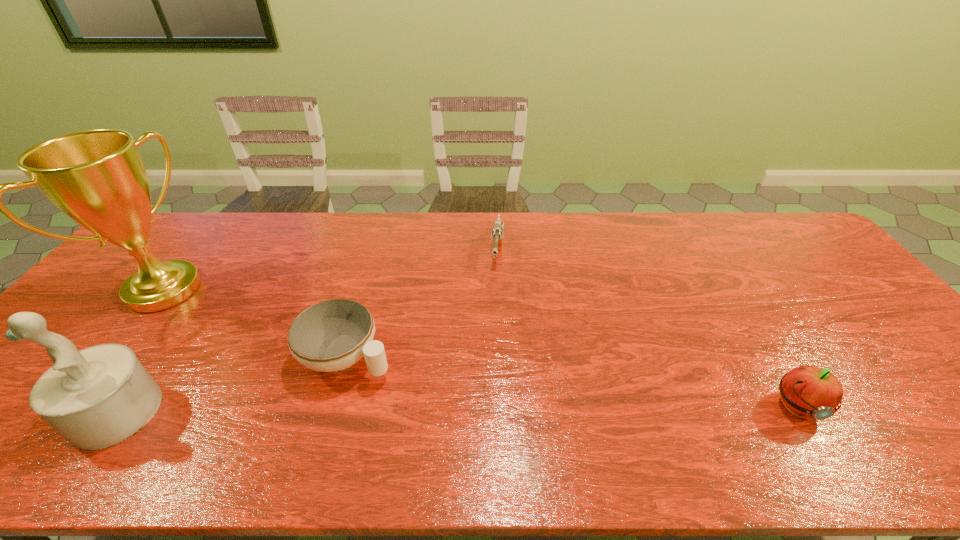
This screenshot has width=960, height=540. What are the coordinates of `figurine` in the screenshot? It's located at (99, 396).

Where is `the rightmost object`? the rightmost object is located at coordinates (x=810, y=392).

Image resolution: width=960 pixels, height=540 pixels. What are the coordinates of `the fourth object from left to right` in the screenshot? It's located at (497, 232).

Where is `chinaware`? chinaware is located at coordinates (332, 335).

Where is `award`? award is located at coordinates (96, 177).

The width and height of the screenshot is (960, 540). Find the location of `vacant space located at the beak of the figurine`. vacant space located at the beak of the figurine is located at coordinates (50, 412).

You are a GUI agent. You are given a task and a screenshot of the screen. Output one action in this format:
    pyautogui.click(x=<x>, y=<y>)
    Task: Click on the vacant space located 0.070m at the beak of the figurine
    Image resolution: width=960 pixels, height=540 pixels.
    Given the screenshot: What is the action you would take?
    pyautogui.click(x=45, y=412)

This screenshot has height=540, width=960. I want to click on vacant space located 0.180m aimed along the barrel of the gun, so click(x=493, y=311).

Where is `vacant point located 0.280m aimed along the barrel of the gun`? This screenshot has height=540, width=960. vacant point located 0.280m aimed along the barrel of the gun is located at coordinates (491, 339).

Where is `vacant space located 0.240m aimed along the barrel of the gun`? The width and height of the screenshot is (960, 540). vacant space located 0.240m aimed along the barrel of the gun is located at coordinates (492, 327).